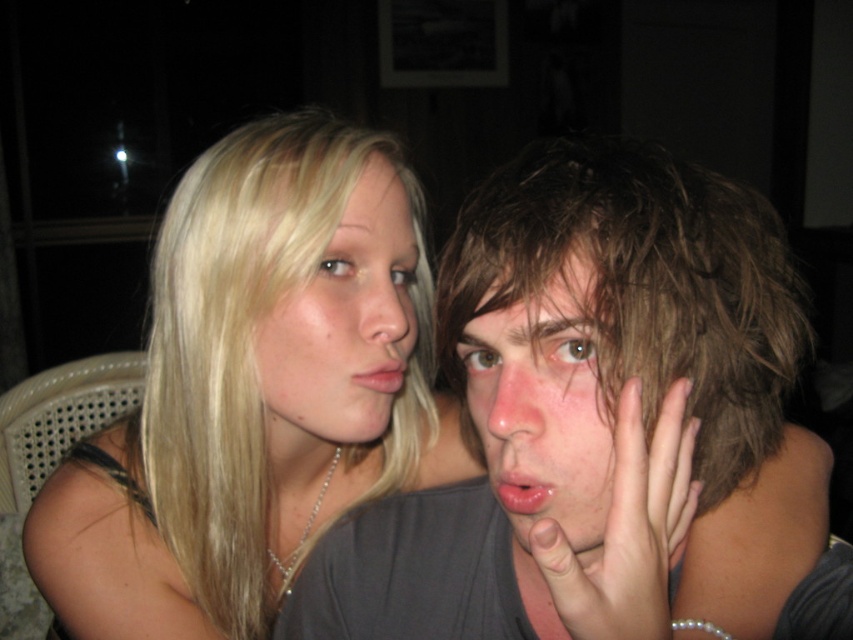
Between pearl bracelet at right and glossy pink lips at center, which one is positioned higher?

glossy pink lips at center

Is point (641, 422) closer to camera compared to point (535, 484)?

Yes, it is in front of point (535, 484).

I want to click on pearl bracelet at right, so click(x=627, y=529).

Does blonde hair at left have a lesser height compared to glossy pink lips at center?

Incorrect, blonde hair at left's height does not fall short of glossy pink lips at center's.

Measure the distance from blonde hair at left to glossy pink lips at center.

They are 11.82 inches apart.

Between point (396, 468) and point (506, 474), which one is positioned behind?

Point (396, 468)

This screenshot has height=640, width=853. What are the coordinates of `blonde hair at left` in the screenshot? It's located at (253, 390).

Is blonde hair at left below dry skin face at right?

Actually, blonde hair at left is above dry skin face at right.

Who is higher up, blonde hair at left or dry skin face at right?

blonde hair at left is above.

Does point (312, 448) lie in front of point (602, 440)?

That is False.

Locate an element on the screen. blonde hair at left is located at coordinates (253, 390).